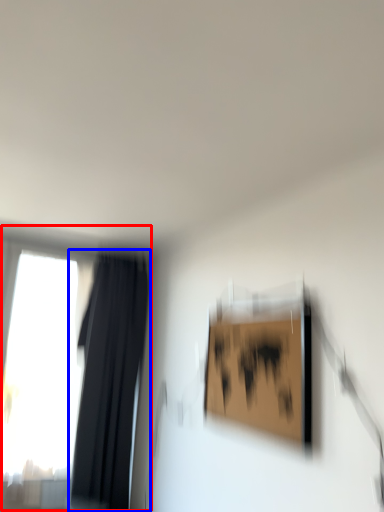
Question: Among these objects, which one is farthest to the camera, window (highlighted by a red box) or curtain (highlighted by a blue box)?

Choices:
 (A) window
 (B) curtain

Answer: (A)